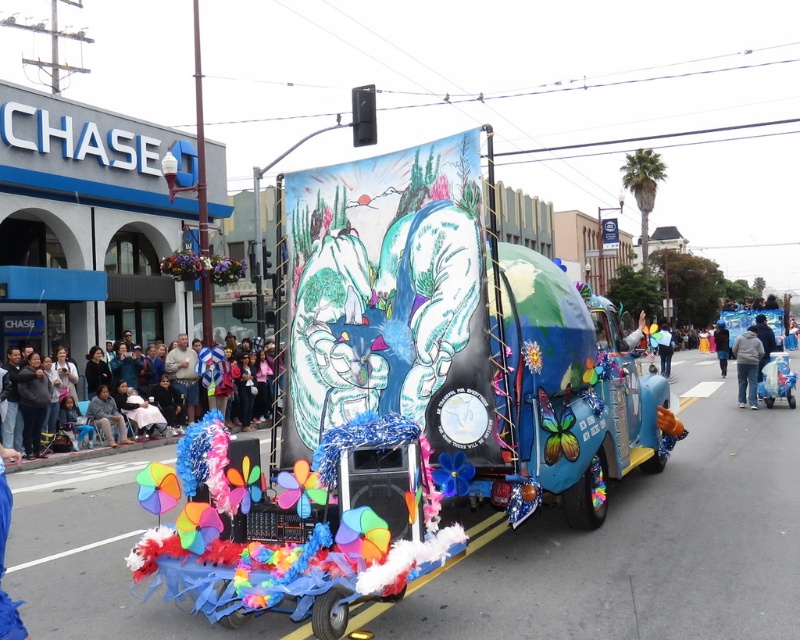
You are a photographer standing in the crowd watching the parade. You want to take a photo that includes both the multicolored fabric at lower left and the blue fabric balloon at center. Which object will appear larger in your photo?

The multicolored fabric at lower left will appear larger in the photo because it is closer to the viewer than the blue fabric balloon at center.

You are a photographer at the parade and want to capture the blue fabric balloon at center and the blue fabric at center in your shot. Which object should you focus on to ensure it fills more of your camera frame?

The blue fabric balloon at center is bigger than the blue fabric at center, so focusing on it will fill more of the camera frame.